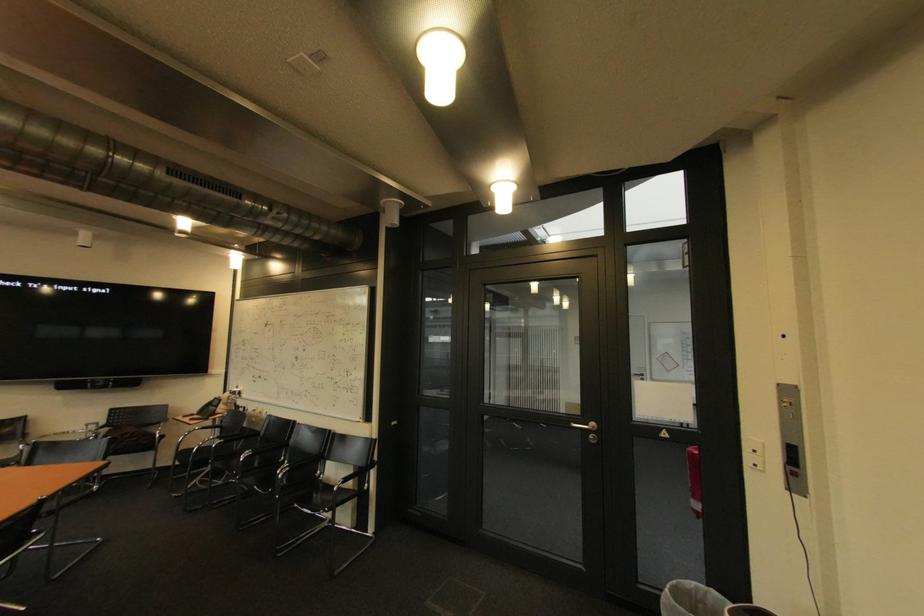
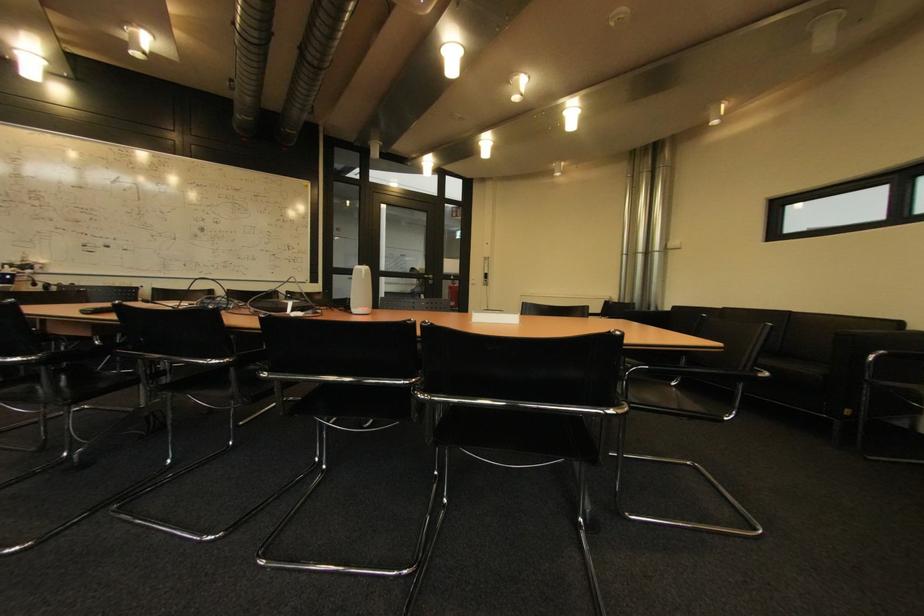
Where in the second image is the point corresponding to (x=659, y=432) from the first image?

(456, 278)